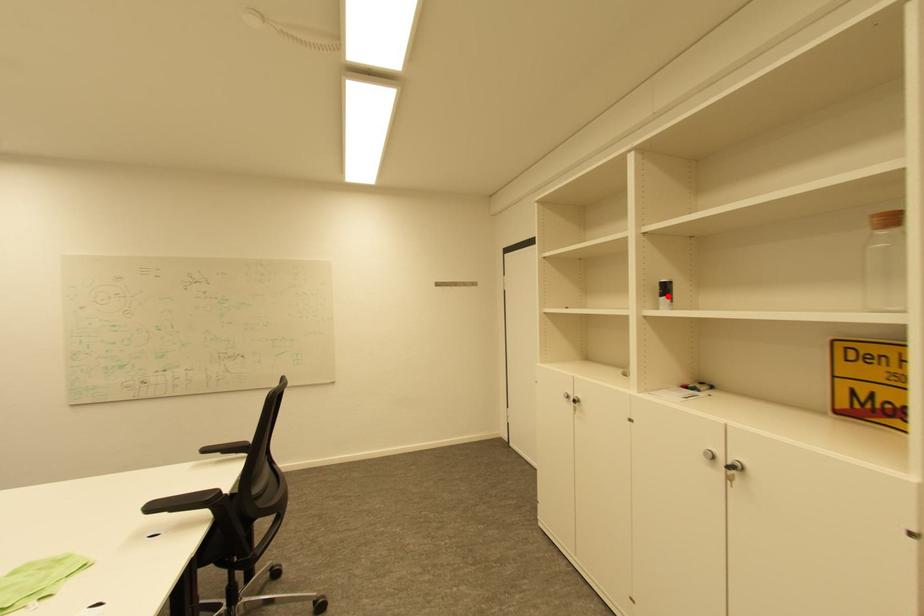
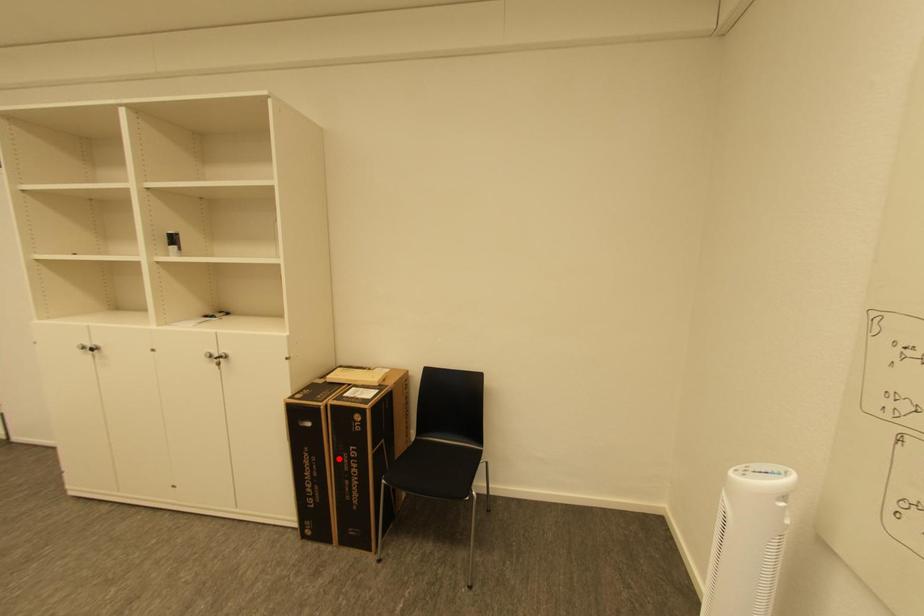
I am providing you with two images of the same scene from different viewpoints. A red point is marked on the first image and another point is marked on the second image. Is the red point in image1 aligned with the point shown in image2?

No